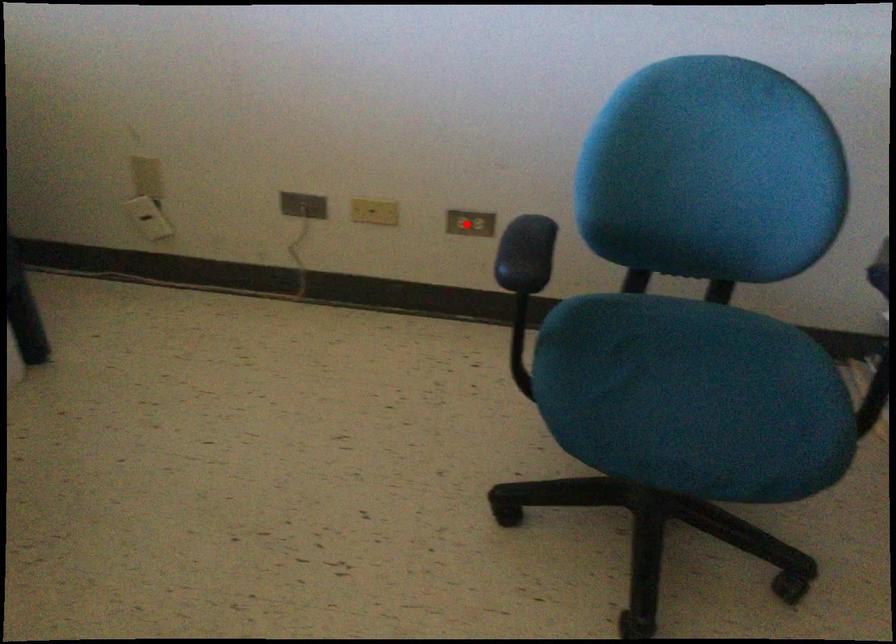
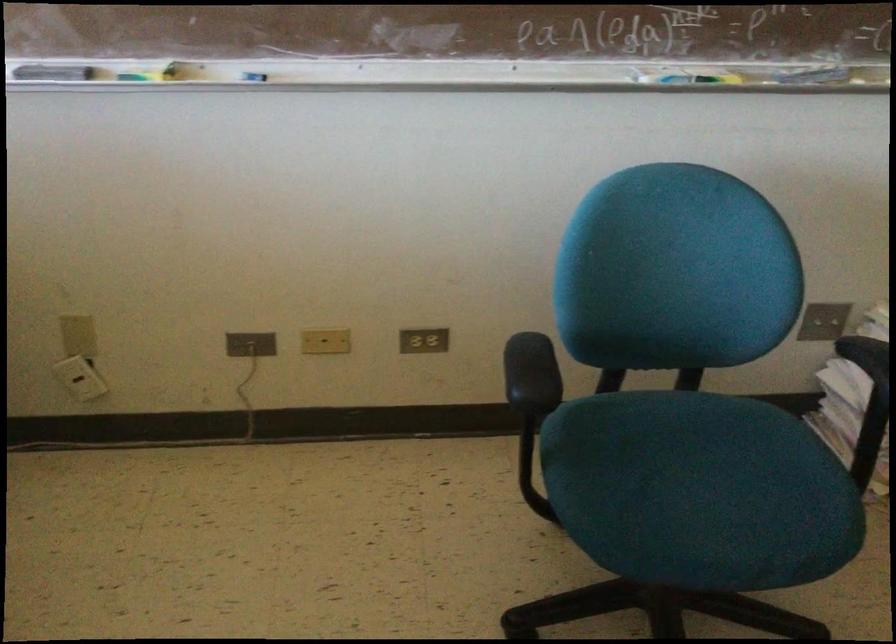
Question: I am providing you with two images of the same scene from different viewpoints. A red point is marked on the first image. Is the red point's position out of view in image 2?

Choices:
 (A) Yes
 (B) No

Answer: (B)